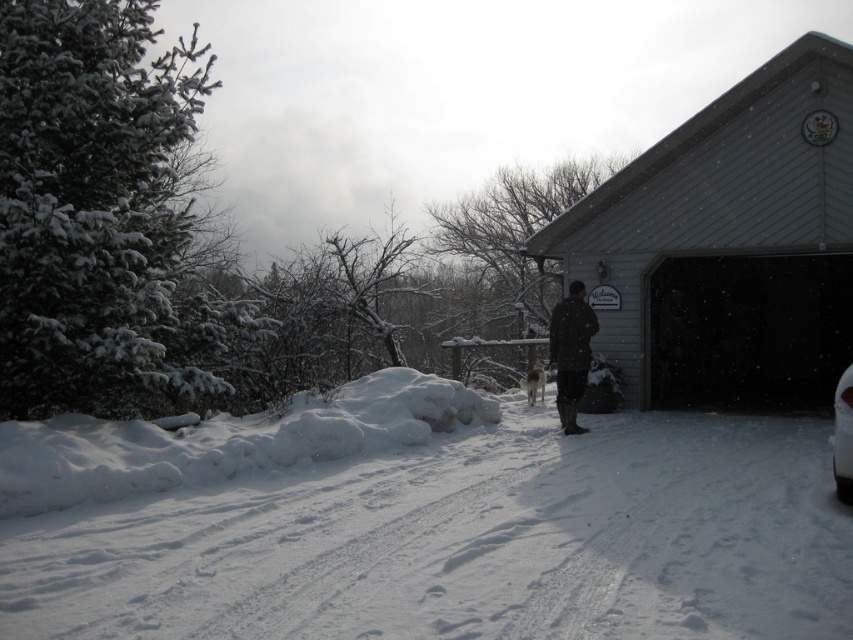
You are standing at the center of the image and want to walk to the house. The white fluffy snow at center is in your path. Can you step over it?

The white fluffy snow at center is located at point (422, 524), so yes, you can step over the white fluffy snow at center as it is positioned at that coordinate which might be part of your path towards the house.

You are standing at the edge of the snowy area and want to walk to the house. The path is covered with white fluffy snow at center and black wool coat at center. Which object is wider, making it easier to walk on?

The white fluffy snow at center is wider than the black wool coat at center, so it would be easier to walk on the white fluffy snow at center.

You are standing at the entrance of the house and want to park your car in the driveway. The driveway is between the gray siding garage at upper right and the white glossy car at lower right. Can you drive your car through the space between them?

The white glossy car at lower right is behind the gray siding garage at upper right, so there is no space between them for your car to drive through.